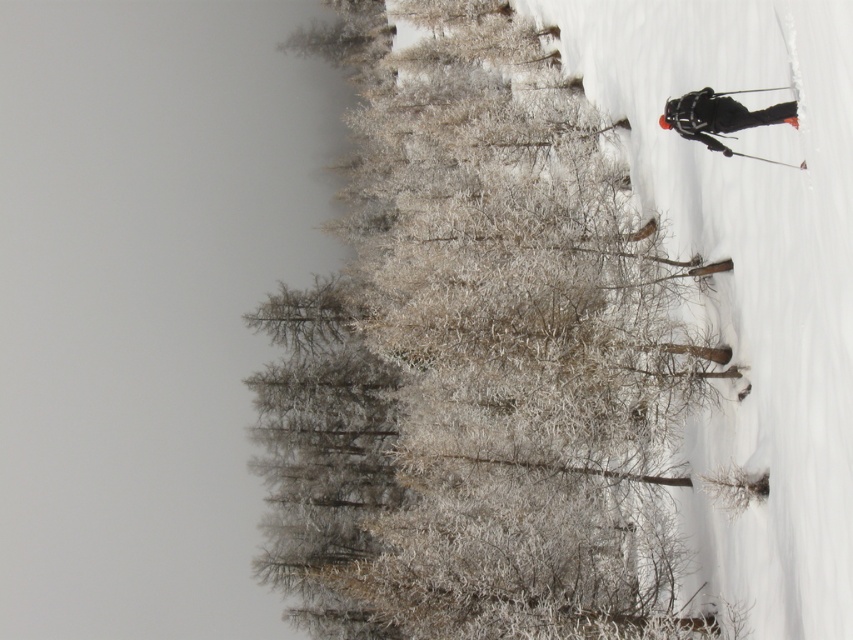
Question: Which of these objects is positioned farthest from the white snow at right?

Choices:
 (A) frosted snow-covered trees at center
 (B) black matte ski suit at right

Answer: (B)

Question: Among these objects, which one is nearest to the camera?

Choices:
 (A) black matte ski suit at right
 (B) frosted snow-covered trees at center
 (C) white snow at right

Answer: (C)

Question: Is frosted snow-covered trees at center positioned behind black matte ski suit at right?

Choices:
 (A) no
 (B) yes

Answer: (B)

Question: Estimate the real-world distances between objects in this image. Which object is farther from the white snow at right?

Choices:
 (A) black matte ski suit at right
 (B) frosted snow-covered trees at center

Answer: (A)

Question: Is frosted snow-covered trees at center smaller than black matte ski suit at right?

Choices:
 (A) no
 (B) yes

Answer: (A)

Question: Where is frosted snow-covered trees at center located in relation to white snow at right in the image?

Choices:
 (A) below
 (B) above

Answer: (A)